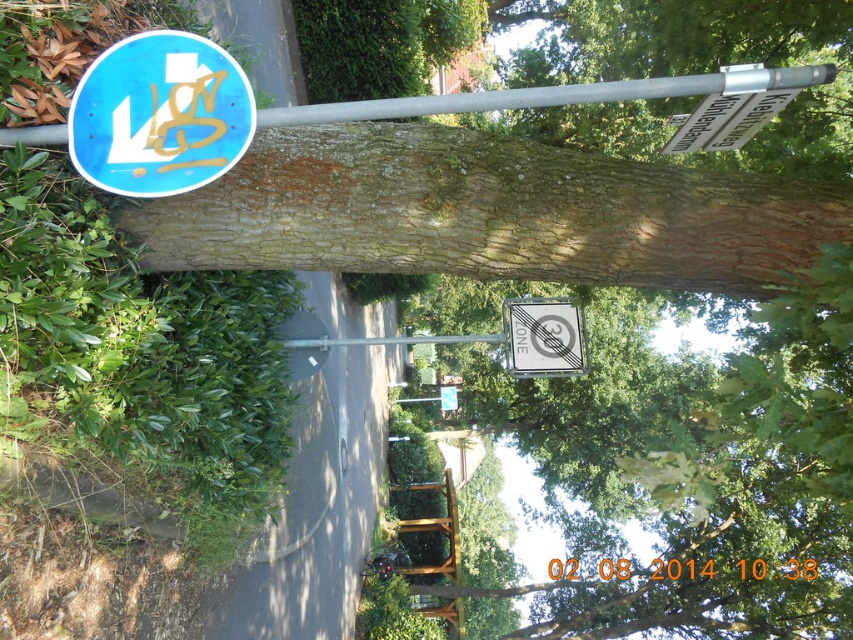
You are a pedestrian standing in front of the silver metallic pole at upper center and the metallic gray no parking sign at center. Which object is nearer to you?

The silver metallic pole at upper center is closer to the viewer than the metallic gray no parking sign at center.

You are standing 1.6 meters away from the blue glossy traffic sign at upper left. Can you reach it?

The blue glossy traffic sign at upper left is 1.74 meters away from you, so you cannot reach it since you are only 1.6 meters away.

You are a city planner assessing the street layout. You need to determine if the silver metallic pole at upper center can be moved closer to the tree trunk without overlapping the metallic gray no parking sign at center. Based on their sizes, is this feasible?

The silver metallic pole at upper center occupies less space than the metallic gray no parking sign at center. Moving it closer may be possible as it is smaller, but ensure there is enough space between them to avoid overlap.